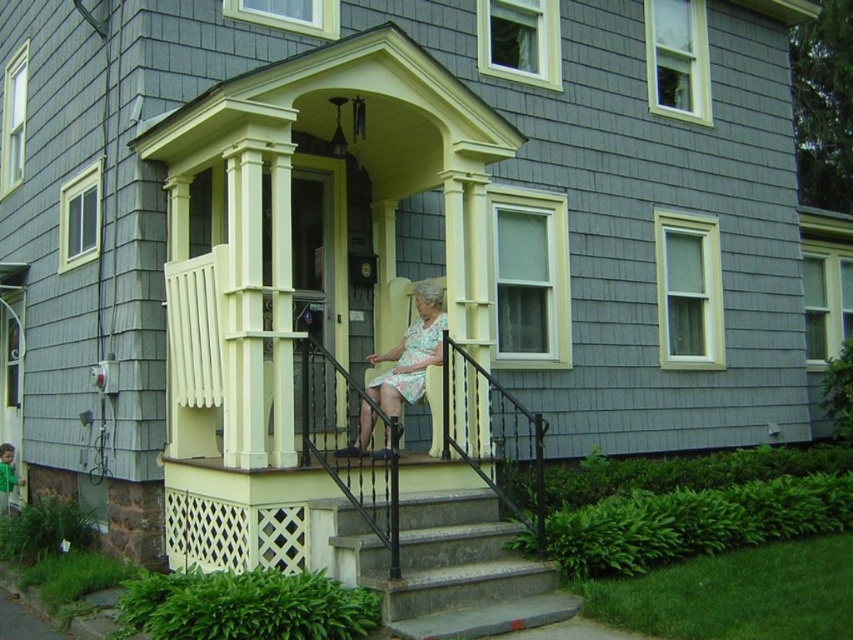
Question: Which object is closer to the camera taking this photo?

Choices:
 (A) concrete steps at center
 (B) floral fabric dress at center

Answer: (A)

Question: Which object appears closest to the camera in this image?

Choices:
 (A) concrete steps at center
 (B) floral print fabric dress at center

Answer: (A)

Question: Among these points, which one is farthest from the camera?

Choices:
 (A) [x=415, y=337]
 (B) [x=428, y=348]

Answer: (A)

Question: Does concrete steps at center have a larger size compared to floral print fabric dress at center?

Choices:
 (A) yes
 (B) no

Answer: (A)

Question: Is concrete steps at center positioned in front of floral fabric dress at center?

Choices:
 (A) yes
 (B) no

Answer: (A)

Question: Where is concrete steps at center located in relation to floral print fabric dress at center in the image?

Choices:
 (A) right
 (B) left

Answer: (A)